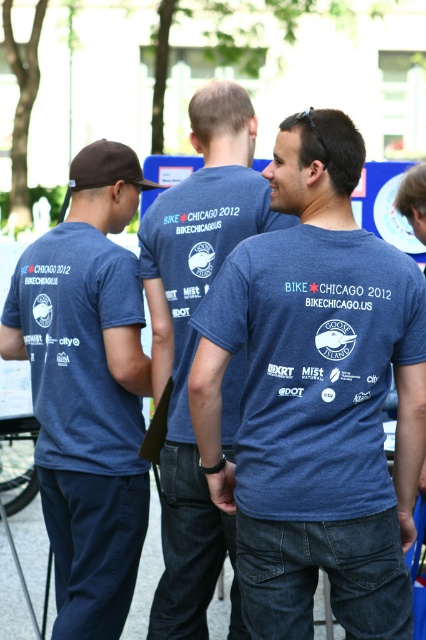
Is matte blue t-shirt at center smaller than blue cotton t-shirt at center?

Yes, matte blue t-shirt at center is smaller than blue cotton t-shirt at center.

Between matte blue t-shirt at center and blue cotton t-shirt at center, which one has more height?

blue cotton t-shirt at center is taller.

You are a GUI agent. You are given a task and a screenshot of the screen. Output one action in this format:
    pyautogui.click(x=<x>, y=<y>)
    Task: Click on the matte blue t-shirt at center
    
    Given the screenshot: What is the action you would take?
    pyautogui.click(x=316, y=397)

I want to click on matte blue t-shirt at center, so click(x=316, y=397).

Which is in front, point (114, 166) or point (210, 150)?

Point (210, 150)

Can you confirm if matte blue t-shirt at left is positioned below blue cotton t-shirt at center?

Yes.

Who is more forward, (66, 636) or (236, 410)?

Point (236, 410)

Where is `matte blue t-shirt at left`? Image resolution: width=426 pixels, height=640 pixels. matte blue t-shirt at left is located at coordinates (88, 388).

How far apart are matte blue t-shirt at center and matte blue t-shirt at left?

The distance of matte blue t-shirt at center from matte blue t-shirt at left is 35.36 inches.

Can you confirm if matte blue t-shirt at center is thinner than matte blue t-shirt at left?

No, matte blue t-shirt at center is not thinner than matte blue t-shirt at left.

Describe the element at coordinates (316, 397) in the screenshot. Image resolution: width=426 pixels, height=640 pixels. I see `matte blue t-shirt at center` at that location.

You are a GUI agent. You are given a task and a screenshot of the screen. Output one action in this format:
    pyautogui.click(x=<x>, y=<y>)
    Task: Click on the matte blue t-shirt at center
    This screenshot has height=640, width=426.
    Given the screenshot: What is the action you would take?
    pyautogui.click(x=316, y=397)